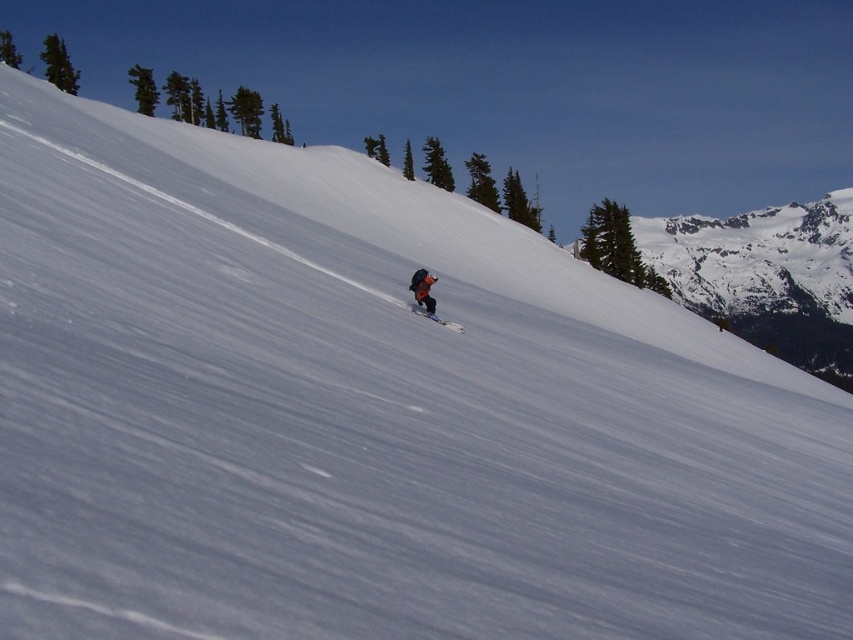
Question: Does matte black jacket at center have a lesser width compared to matte orange ski at center?

Choices:
 (A) yes
 (B) no

Answer: (A)

Question: Does matte black jacket at center appear on the right side of matte orange ski at center?

Choices:
 (A) yes
 (B) no

Answer: (B)

Question: Is matte black jacket at center wider than matte orange ski at center?

Choices:
 (A) yes
 (B) no

Answer: (B)

Question: Which point appears farthest from the camera in this image?

Choices:
 (A) click(x=463, y=328)
 (B) click(x=436, y=276)

Answer: (B)